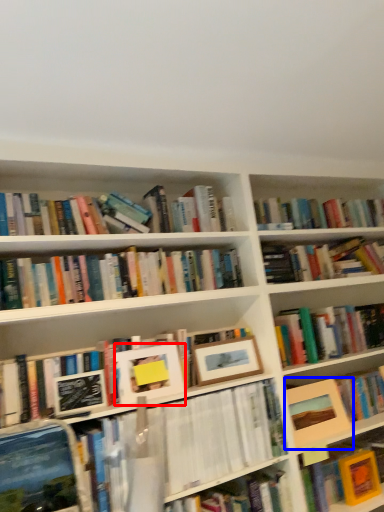
Question: Which object appears farthest to the camera in this image, picture frame (highlighted by a red box) or picture frame (highlighted by a blue box)?

Choices:
 (A) picture frame
 (B) picture frame

Answer: (B)